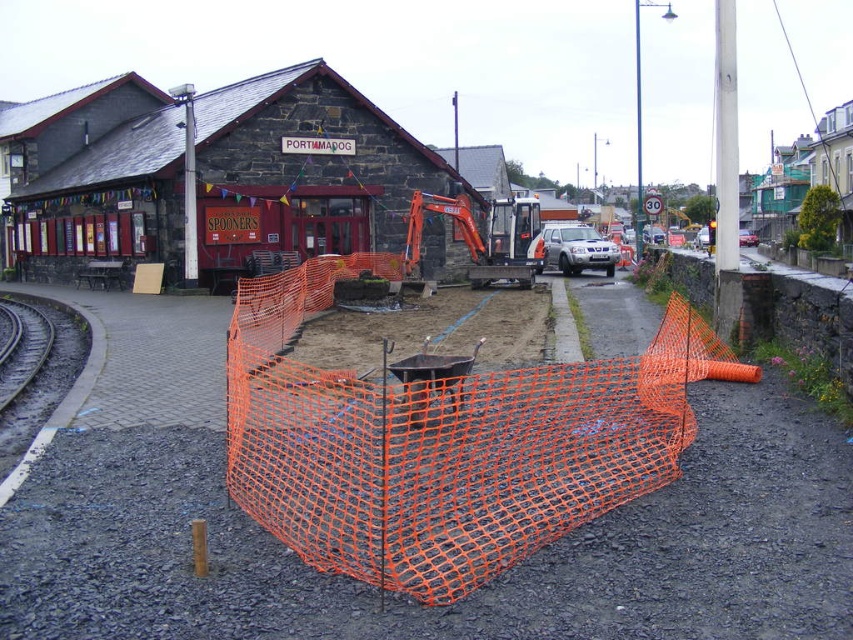
Question: Among these points, which one is nearest to the camera?

Choices:
 (A) (294, 516)
 (B) (360, 113)

Answer: (A)

Question: Is orange mesh fence at center wider than stone textured building at upper left?

Choices:
 (A) no
 (B) yes

Answer: (A)

Question: Among these points, which one is nearest to the camera?

Choices:
 (A) (166, 156)
 (B) (447, 413)

Answer: (B)

Question: From the image, what is the correct spatial relationship of orange mesh fence at center in relation to stone textured building at upper left?

Choices:
 (A) right
 (B) left

Answer: (A)

Question: Observing the image, what is the correct spatial positioning of orange mesh fence at center in reference to stone textured building at upper left?

Choices:
 (A) right
 (B) left

Answer: (A)

Question: Which object is farther from the camera taking this photo?

Choices:
 (A) stone textured building at upper left
 (B) orange mesh fence at center

Answer: (A)